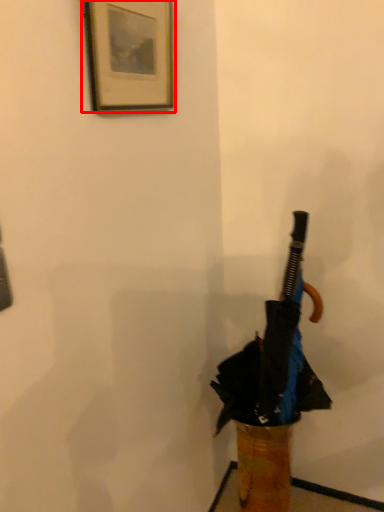
Question: Observing the image, what is the correct spatial positioning of picture frame (annotated by the red box) in reference to umbrella?

Choices:
 (A) right
 (B) left

Answer: (B)